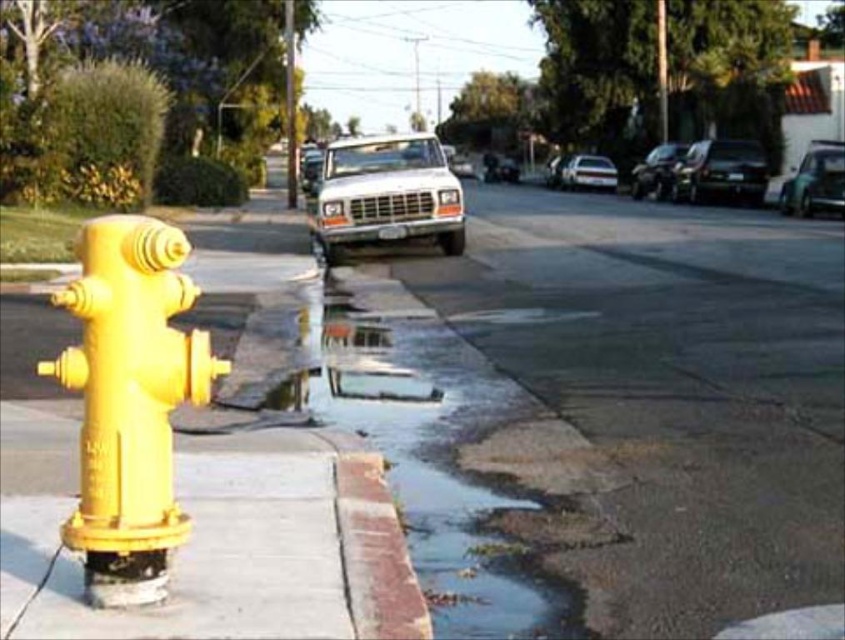
Question: Which point is farther to the camera?

Choices:
 (A) (688, 202)
 (B) (450, 196)
 (C) (264, 381)

Answer: (A)

Question: Among these objects, which one is nearest to the camera?

Choices:
 (A) metallic blue car at right
 (B) shiny black car at upper right
 (C) yellow matte fire hydrant at left

Answer: (C)

Question: Does glossy concrete puddle at lower left appear over metallic silver sedan at center?

Choices:
 (A) no
 (B) yes

Answer: (A)

Question: Does yellow matte fire hydrant at left have a larger size compared to metallic blue car at right?

Choices:
 (A) yes
 (B) no

Answer: (B)

Question: Can you confirm if glossy black car at upper right is smaller than metallic silver sedan at center?

Choices:
 (A) yes
 (B) no

Answer: (B)

Question: Which object is positioned closest to the yellow matte fire hydrant at left?

Choices:
 (A) white matte truck at center
 (B) metallic silver sedan at center
 (C) glossy black car at upper right
 (D) glossy concrete puddle at lower left

Answer: (D)